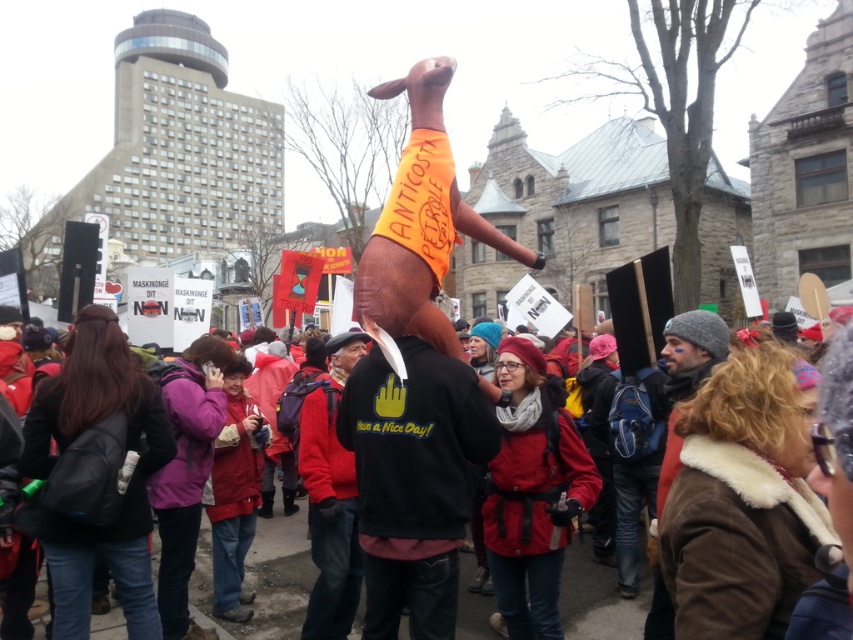
Between point (643, 604) and point (326, 586), which one is positioned behind?

Point (643, 604)

Does matte black jacket at center have a lesser height compared to red fleece jacket at center?

Indeed, matte black jacket at center has a lesser height compared to red fleece jacket at center.

Between point (196, 604) and point (311, 452), which one is positioned in front?

Point (196, 604) is more forward.

I want to click on matte black jacket at center, so click(x=276, y=579).

Between matte black jacket at center and brown fur coat at right, which one appears on the right side from the viewer's perspective?

brown fur coat at right is more to the right.

In the scene shown: Who is shorter, matte black jacket at center or brown fur coat at right?

matte black jacket at center

Who is more distant from viewer, (288, 573) or (712, 358)?

The point (288, 573) is more distant.

What are the coordinates of `matte black jacket at center` in the screenshot? It's located at (276, 579).

In the scene shown: Is red fleece jacket at center positioned at the back of brown fur coat at right?

Answer: Yes.

Is red fleece jacket at center to the right of brown fur coat at right from the viewer's perspective?

Incorrect, red fleece jacket at center is not on the right side of brown fur coat at right.

The height and width of the screenshot is (640, 853). Describe the element at coordinates (329, 497) in the screenshot. I see `red fleece jacket at center` at that location.

Identify the location of red fleece jacket at center. (329, 497).